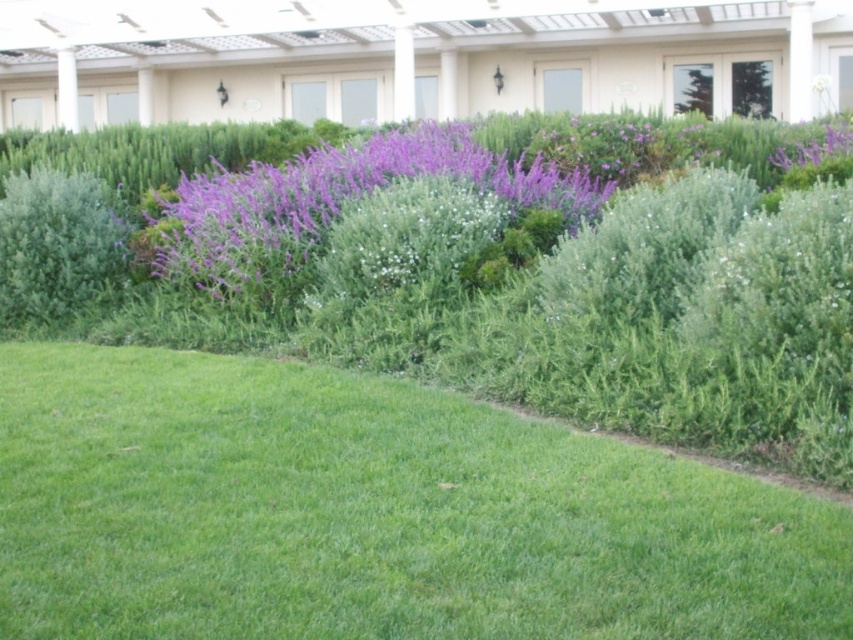
Is green grass at lower left further to camera compared to purple matte flower at upper right?

No, green grass at lower left is closer to the viewer.

Is green grass at lower left above purple matte flower at upper right?

Incorrect, green grass at lower left is not positioned above purple matte flower at upper right.

Is point (693, 520) in front of point (769, 156)?

Yes, it is in front of point (769, 156).

Find the location of a particular element. green grass at lower left is located at coordinates (372, 515).

Does purple soft-textured flowers at center lie in front of green fuzzy bush at left?

Yes, it is.

Identify the location of purple soft-textured flowers at center. Image resolution: width=853 pixels, height=640 pixels. (334, 204).

Between point (247, 289) and point (83, 212), which one is positioned behind?

The point (83, 212) is more distant.

Locate an element on the screen. purple soft-textured flowers at center is located at coordinates (334, 204).

Is green grass at lower left shorter than green fuzzy bush at left?

Yes, green grass at lower left is shorter than green fuzzy bush at left.

Can you confirm if green grass at lower left is bigger than green fuzzy bush at left?

Incorrect, green grass at lower left is not larger than green fuzzy bush at left.

Between point (74, 352) and point (61, 202), which one is positioned in front?

Point (74, 352) is more forward.

Image resolution: width=853 pixels, height=640 pixels. Find the location of `green grass at lower left`. green grass at lower left is located at coordinates click(x=372, y=515).